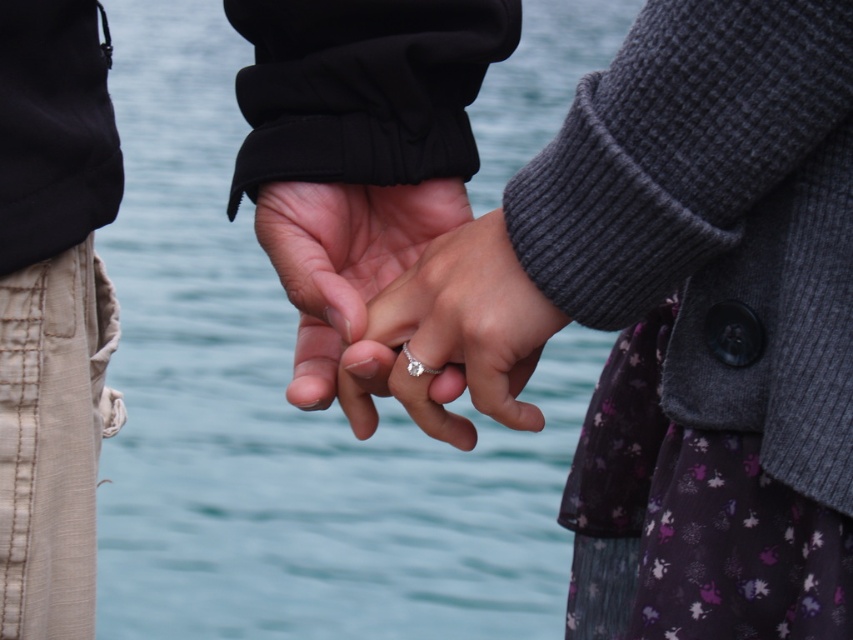
Does blue water at center come behind diamond silver ring at center?

Yes.

Does point (383, 524) lie in front of point (421, 364)?

No.

Find the location of `blue water at center`. blue water at center is located at coordinates (287, 413).

Between matte silver ring at center and diamond silver ring at center, which one has less height?

diamond silver ring at center is shorter.

Does matte silver ring at center lie in front of diamond silver ring at center?

No, it is not.

What do you see at coordinates (347, 276) in the screenshot? The image size is (853, 640). I see `matte silver ring at center` at bounding box center [347, 276].

Locate an element on the screen. The image size is (853, 640). matte silver ring at center is located at coordinates (347, 276).

Does silver metallic ring at center appear under diamond silver ring at center?

Actually, silver metallic ring at center is above diamond silver ring at center.

Between point (445, 280) and point (413, 362), which one is positioned in front?

Point (445, 280)

Describe the element at coordinates (453, 337) in the screenshot. Image resolution: width=853 pixels, height=640 pixels. I see `silver metallic ring at center` at that location.

At what (x,y) coordinates should I click in order to perform the action: click on silver metallic ring at center. Please return your answer as a coordinate pair (x, y). Image resolution: width=853 pixels, height=640 pixels. Looking at the image, I should click on (453, 337).